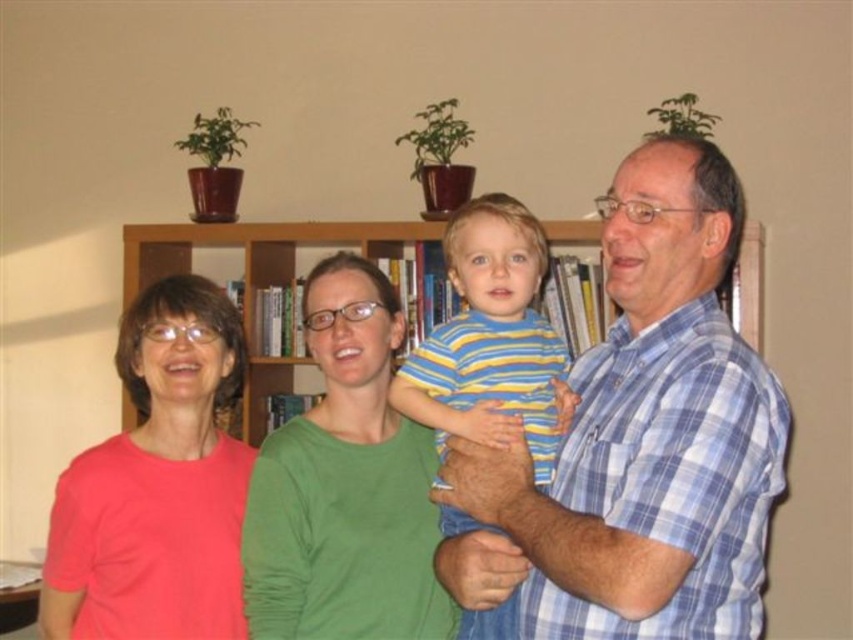
You are a photographer setting up for a family photo. You need to ensure that the green matte shirt at center and the striped cotton shirt at center are at least 25 centimeters apart to avoid overcrowding. Based on the current setup, is this requirement met?

The green matte shirt at center and the striped cotton shirt at center are 20.59 centimeters apart from each other, which is less than the required 25 centimeters. Therefore, the requirement is not met and they are too close together.